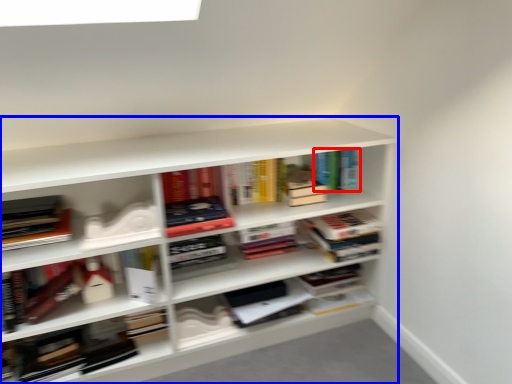
Question: Which object appears closest to the camera in this image, book (highlighted by a red box) or shelf (highlighted by a blue box)?

Choices:
 (A) book
 (B) shelf

Answer: (B)